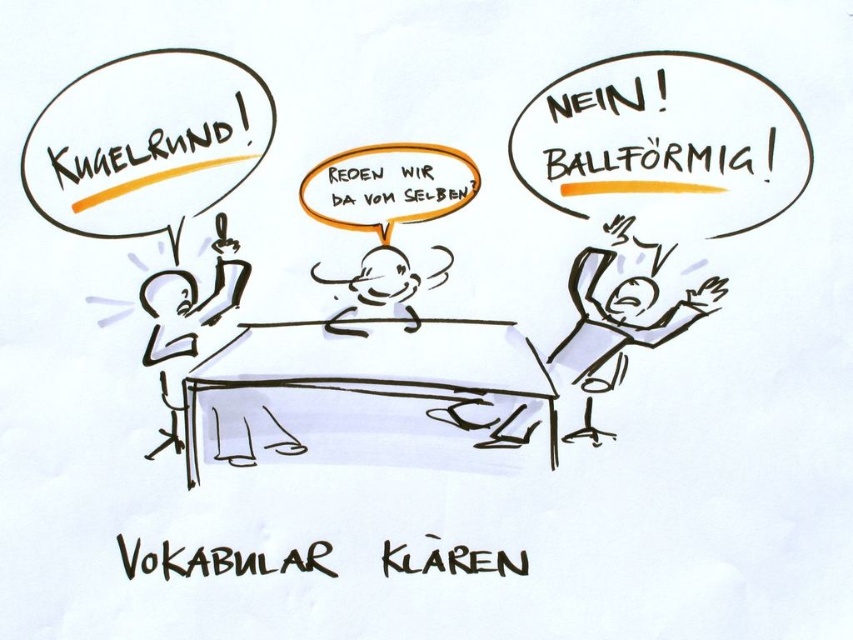
Can you confirm if gray paper at center is smaller than smooth white head at center?

No, gray paper at center is not smaller than smooth white head at center.

How distant is gray paper at center from smooth white head at center?

gray paper at center and smooth white head at center are 14.47 centimeters apart from each other.

Does point (619, 237) come closer to viewer compared to point (399, 260)?

Yes, it is.

Find the location of `gray paper at center`. gray paper at center is located at coordinates (624, 310).

Is point (78, 113) positioned after point (397, 292)?

No.

Does yellow marker text at upper left have a larger size compared to smooth white head at center?

Yes, yellow marker text at upper left is bigger than smooth white head at center.

The image size is (853, 640). In order to click on yellow marker text at upper left in this screenshot , I will do `click(146, 141)`.

Does yellow marker text at upper left appear over gray paper at center?

Yes.

Between yellow marker text at upper left and gray paper at center, which one appears on the right side from the viewer's perspective?

gray paper at center

Identify the location of yellow marker text at upper left. (146, 141).

The height and width of the screenshot is (640, 853). Find the location of `yellow marker text at upper left`. yellow marker text at upper left is located at coordinates (146, 141).